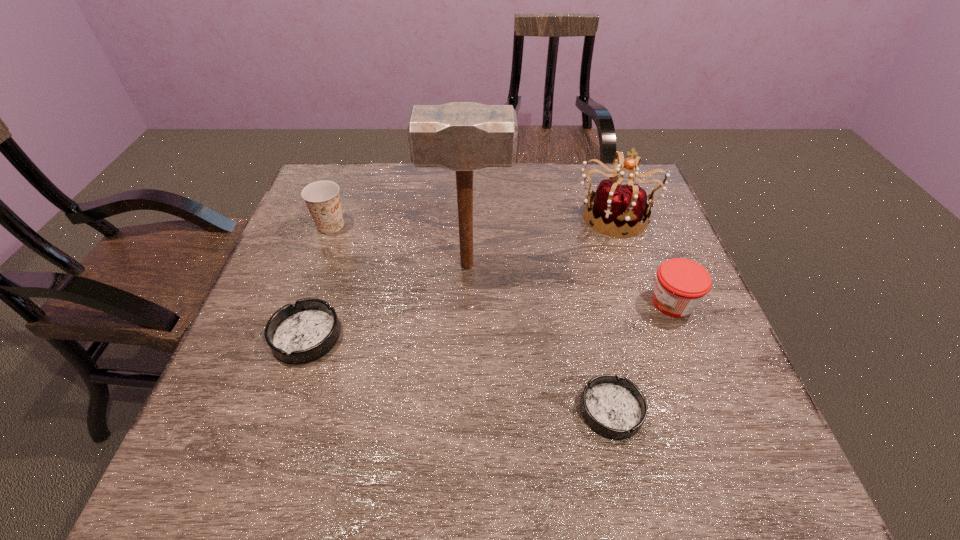
The image size is (960, 540). Find the location of `the taller ashtray`. the taller ashtray is located at coordinates (303, 332).

You are a GUI agent. You are given a task and a screenshot of the screen. Output one action in this format:
    pyautogui.click(x=<x>, y=<y>)
    Task: Click on the second shortest object
    Image resolution: width=960 pixels, height=540 pixels.
    Given the screenshot: What is the action you would take?
    pyautogui.click(x=303, y=332)

Locate an element on the screen. The height and width of the screenshot is (540, 960). the nearer ashtray is located at coordinates coord(616,408).

At what (x,y) coordinates should I click in order to perform the action: click on the right ashtray. Please return your answer as a coordinate pair (x, y). Looking at the image, I should click on (616, 408).

Locate an element on the screen. The image size is (960, 540). the tallest object is located at coordinates (463, 137).

Where is `the third farthest object`? Image resolution: width=960 pixels, height=540 pixels. the third farthest object is located at coordinates (463, 137).

The width and height of the screenshot is (960, 540). In order to click on tiara in this screenshot , I will do `click(619, 205)`.

At what (x,y) coordinates should I click in order to perform the action: click on the fourth shortest object. Please return your answer as a coordinate pair (x, y). This screenshot has width=960, height=540. Looking at the image, I should click on (322, 198).

Where is `jam`? jam is located at coordinates (681, 284).

Identify the location of vacant space located 0.110m on the front of the left ashtray. pos(280,415).